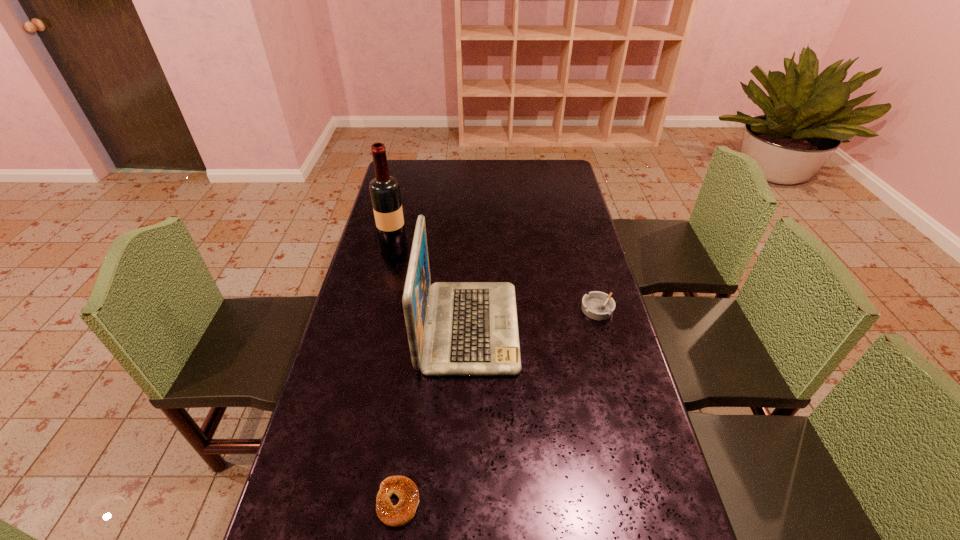
You are a GUI agent. You are given a task and a screenshot of the screen. Output one action in this format:
    pyautogui.click(x=<x>, y=<y>)
    Task: Click on the wine bottle
    
    Given the screenshot: What is the action you would take?
    coord(384,189)

Identify the location of the farthest object. The image size is (960, 540). (384, 189).

The width and height of the screenshot is (960, 540). In order to click on laptop computer in this screenshot , I will do `click(454, 328)`.

At what (x,y) coordinates should I click in order to perform the action: click on the rightmost object. Please return your answer as a coordinate pair (x, y). The height and width of the screenshot is (540, 960). Looking at the image, I should click on (597, 305).

Where is `bagel`? This screenshot has width=960, height=540. bagel is located at coordinates (406, 490).

You are a GUI agent. You are given a task and a screenshot of the screen. Output one action in this format:
    pyautogui.click(x=<x>, y=<y>)
    Task: Click on the vacant space located 0.090m on the right of the wine bottle
    The height and width of the screenshot is (540, 960).
    Given the screenshot: What is the action you would take?
    pyautogui.click(x=432, y=247)

Where is `free space located 0.260m on the screen of the third shortest object`? free space located 0.260m on the screen of the third shortest object is located at coordinates (605, 327).

The width and height of the screenshot is (960, 540). I want to click on free region located on the back of the rightmost object, so click(585, 263).

Find the location of a particular element. This screenshot has height=540, width=960. vacant space located on the right of the bagel is located at coordinates (588, 502).

This screenshot has width=960, height=540. I want to click on object at the left edge, so click(x=384, y=189).